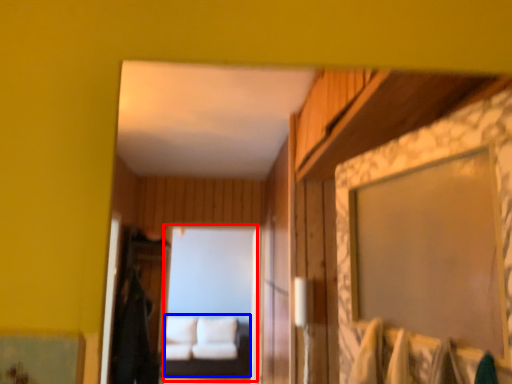
Question: Among these objects, which one is nearest to the camera, mirror (highlighted by a red box) or couch (highlighted by a blue box)?

Choices:
 (A) mirror
 (B) couch

Answer: (A)